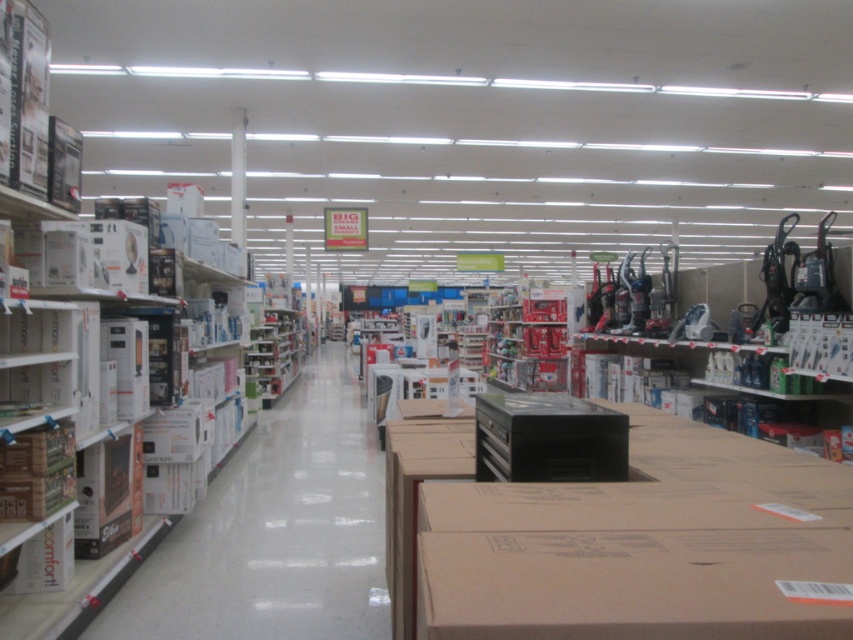
You are a delivery person who just arrived at the store with a new shipment of boxed appliances. You need to place a new brown cardboard box at center in the same section as the existing boxes. Where should you place it?

You should place the new brown cardboard box at center at point coordinates (628, 564).

You are a delivery person who just arrived at the store with a new shipment. You need to place the new shipment in the aisle where the brown cardboard box at center and the white cardboard boxes at left are located. Based on the space they occupy, which existing box should you place the new shipment next to?

The brown cardboard box at center occupies less space than the white cardboard boxes at left, so you should place the new shipment next to the white cardboard boxes at left since they take up more space and there might be more available space there.

In the scene shown: You are a delivery person who just arrived at the store with a new shipment. You need to place a new box on the shelf. The new box is taller than the brown cardboard box at center but shorter than the white cardboard boxes at left. Where should you place the new box to ensure it fits properly?

You should place the new box between the brown cardboard box at center and the white cardboard boxes at left. Since the new box is taller than the brown cardboard box at center but shorter than the white cardboard boxes at left, positioning it in between ensures it fits appropriately in terms of height.